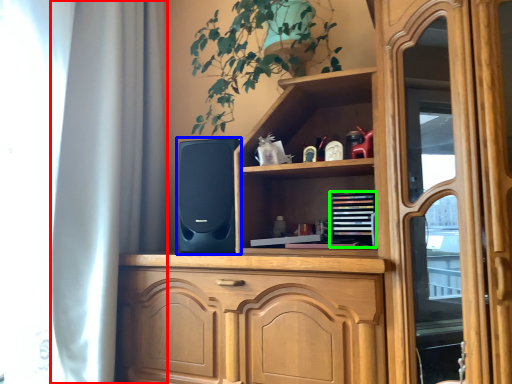
Question: Based on their relative distances, which object is farther from curtain (highlighted by a red box)? Choose from speaker (highlighted by a blue box) and book (highlighted by a green box).

Choices:
 (A) speaker
 (B) book

Answer: (B)